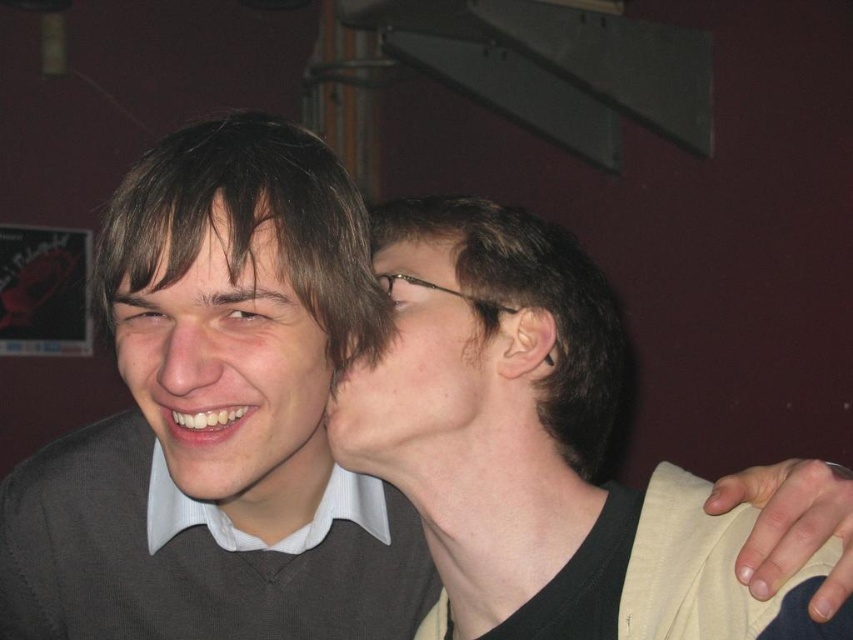
You are a photographer trying to capture a closeup shot of both the matte black hair at center and the matte black face at left in the scene. Given their sizes, which object should you focus on first to ensure it appears sharp in the photo?

The matte black hair at center is larger in size than the matte black face at left, so you should focus on the matte black hair at center first to ensure it appears sharp in the photo.

You are a photographer trying to capture a closeup shot of two people in the scene. You need to ensure that both the matte black hair at center and the matte black face at left are in focus. Given that your camera can only focus on objects within a 5.5 inch range, will both objects be in focus?

The matte black hair at center is 5.79 inches from matte black face at left. Since the distance between them exceeds the camera focus range of 5.5 inches, the two objects will not both be in focus.

You are a photographer trying to capture a closeup shot of both the matte black face at left and the matte skin at center. Given that your camera has a fixed focal length and depth of field, which face should you focus on to ensure the subject is in focus, considering their sizes and positions?

The matte black face at left is larger in size than the matte skin at center, so focusing on the matte black face at left would ensure it is in focus, as larger subjects typically require more precise focus to maintain clarity.